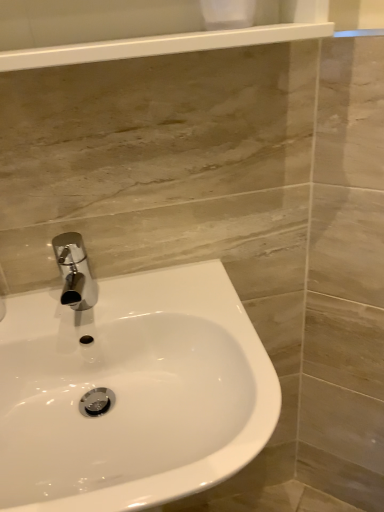
Describe the element at coordinates (131, 392) in the screenshot. The height and width of the screenshot is (512, 384). I see `white glossy sink at center` at that location.

What is the approximate width of white glossy sink at center?

It is 49.12 centimeters.

This screenshot has height=512, width=384. Find the location of `white glossy sink at center`. white glossy sink at center is located at coordinates (131, 392).

Locate an element on the screen. The image size is (384, 512). white glossy sink at center is located at coordinates (131, 392).